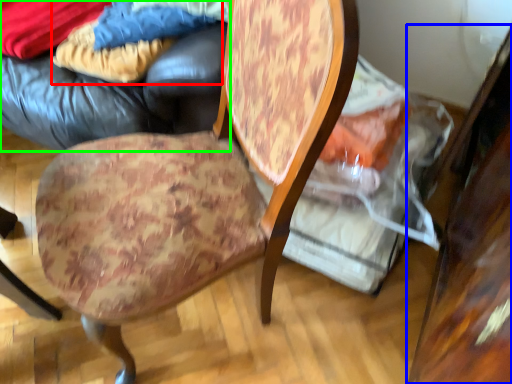
Question: Which object is positioned farthest from fabric (highlighted by a red box)? Select from table (highlighted by a blue box) and bean bag chair (highlighted by a green box).

Choices:
 (A) table
 (B) bean bag chair

Answer: (A)